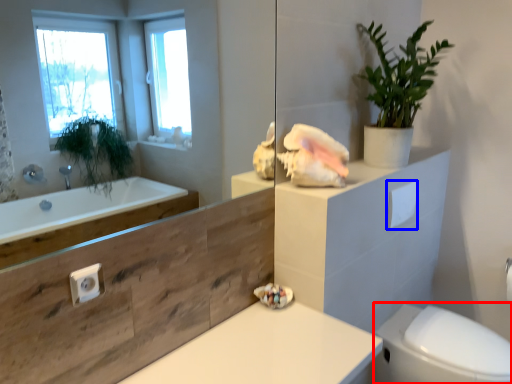
Question: Which point is closer to the camera, bidet (highlighted by a red box) or toilet paper (highlighted by a blue box)?

Choices:
 (A) bidet
 (B) toilet paper

Answer: (A)